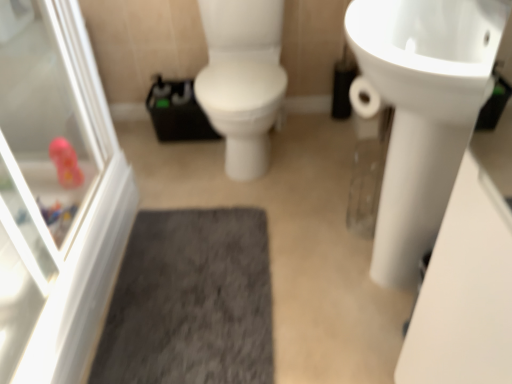
Question: Can you confirm if gray shaggy bath mat at center is thinner than white glossy screen door at left?

Choices:
 (A) yes
 (B) no

Answer: (B)

Question: Is the surface of gray shaggy bath mat at center in direct contact with white glossy screen door at left?

Choices:
 (A) yes
 (B) no

Answer: (B)

Question: Is gray shaggy bath mat at center at the right side of white glossy screen door at left?

Choices:
 (A) no
 (B) yes

Answer: (B)

Question: Is gray shaggy bath mat at center looking in the opposite direction of white glossy screen door at left?

Choices:
 (A) no
 (B) yes

Answer: (A)

Question: From a real-world perspective, is gray shaggy bath mat at center physically above white glossy screen door at left?

Choices:
 (A) yes
 (B) no

Answer: (B)

Question: Is white glossy screen door at left in front of or behind gray shaggy bath mat at center in the image?

Choices:
 (A) front
 (B) behind

Answer: (A)

Question: In terms of width, does white glossy screen door at left look wider or thinner when compared to gray shaggy bath mat at center?

Choices:
 (A) wide
 (B) thin

Answer: (B)

Question: Looking at the image, does white glossy screen door at left seem bigger or smaller compared to gray shaggy bath mat at center?

Choices:
 (A) big
 (B) small

Answer: (A)

Question: From the image's perspective, is white glossy screen door at left above or below gray shaggy bath mat at center?

Choices:
 (A) below
 (B) above

Answer: (B)

Question: Is point (169, 382) closer or farther from the camera than point (418, 145)?

Choices:
 (A) farther
 (B) closer

Answer: (A)

Question: Considering the positions of gray shaggy bath mat at center and white glossy sink at upper right in the image, is gray shaggy bath mat at center taller or shorter than white glossy sink at upper right?

Choices:
 (A) short
 (B) tall

Answer: (A)

Question: Would you say gray shaggy bath mat at center is to the left or to the right of white glossy sink at upper right in the picture?

Choices:
 (A) left
 (B) right

Answer: (A)

Question: In the image, is gray shaggy bath mat at center positioned in front of or behind white glossy sink at upper right?

Choices:
 (A) front
 (B) behind

Answer: (B)

Question: Would you say white glossy screen door at left is inside or outside white glossy sink at upper right?

Choices:
 (A) outside
 (B) inside

Answer: (A)

Question: From their relative heights in the image, would you say white glossy screen door at left is taller or shorter than white glossy sink at upper right?

Choices:
 (A) short
 (B) tall

Answer: (B)